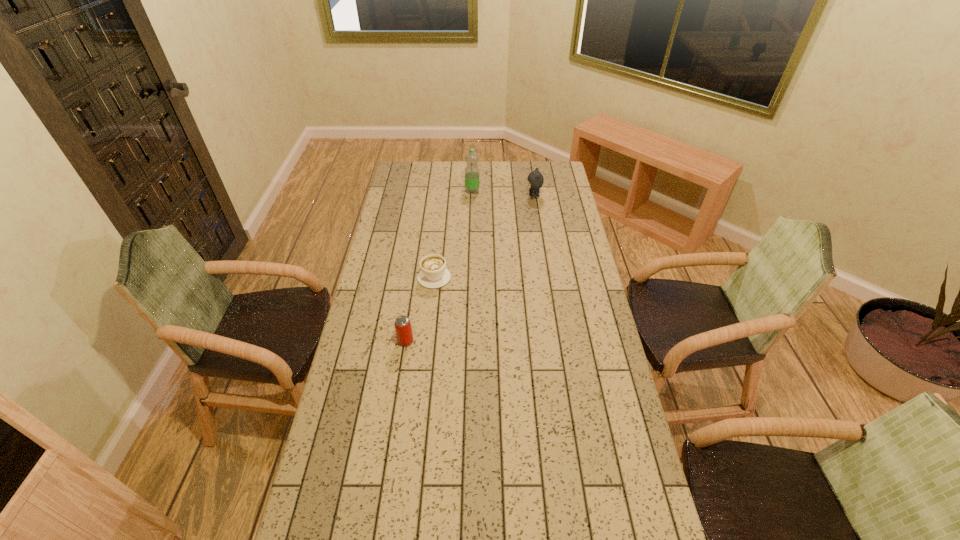
I want to click on water bottle, so tap(471, 157).

You are a GUI agent. You are given a task and a screenshot of the screen. Output one action in this format:
    pyautogui.click(x=<x>, y=<y>)
    Task: Click on the second object from right to left
    The width and height of the screenshot is (960, 540).
    Given the screenshot: What is the action you would take?
    pyautogui.click(x=471, y=157)

Where is `the rightmost object`? the rightmost object is located at coordinates (535, 179).

Locate an element on the screen. The width and height of the screenshot is (960, 540). kitten is located at coordinates (535, 179).

At what (x,y) coordinates should I click in order to perform the action: click on beer can. Please return your answer as a coordinate pair (x, y). The image size is (960, 540). Looking at the image, I should click on (403, 328).

The height and width of the screenshot is (540, 960). Identify the location of the third tallest object. (403, 328).

Find the location of a particular element. Image resolution: width=960 pixels, height=540 pixels. the second nearest object is located at coordinates (433, 274).

Where is `the shortest object`? the shortest object is located at coordinates pos(433,274).

This screenshot has width=960, height=540. In order to click on free space located 0.070m on the back of the second object from right to left in this screenshot , I will do `click(472, 180)`.

Image resolution: width=960 pixels, height=540 pixels. I want to click on free space located on the front-facing side of the kitten, so click(x=465, y=197).